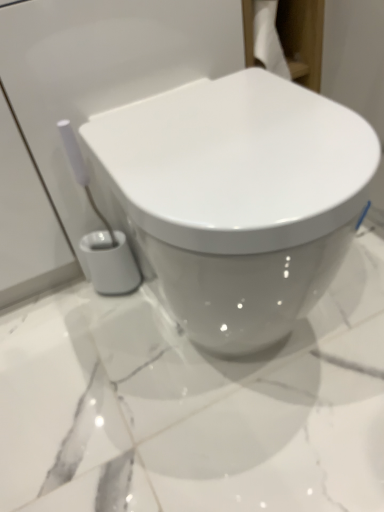
The width and height of the screenshot is (384, 512). In order to click on free space to the left of white glossy toilet at center in this screenshot , I will do `click(88, 374)`.